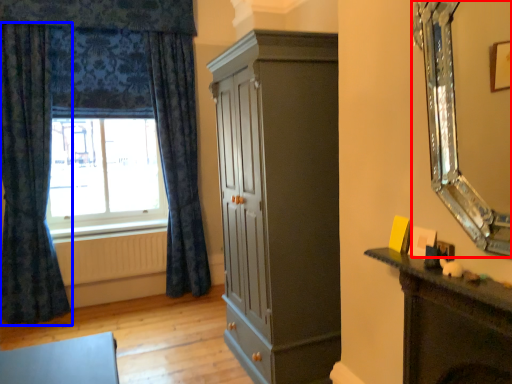
Question: Which point is closer to the camera, mirror (highlighted by a red box) or curtain (highlighted by a blue box)?

Choices:
 (A) mirror
 (B) curtain

Answer: (A)